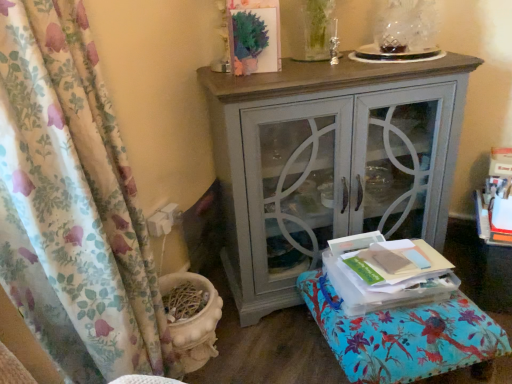
Question: Is floral fabric ottoman at lower right bigger or smaller than matte gray cabinet at center?

Choices:
 (A) big
 (B) small

Answer: (B)

Question: Is floral fabric ottoman at lower right wider or thinner than matte gray cabinet at center?

Choices:
 (A) wide
 (B) thin

Answer: (A)

Question: Which object is the closest to the floral fabric curtain at left?

Choices:
 (A) matte gray cabinet at center
 (B) floral fabric ottoman at lower right

Answer: (A)

Question: Which object is the closest to the floral fabric curtain at left?

Choices:
 (A) matte gray cabinet at center
 (B) floral fabric ottoman at lower right

Answer: (A)